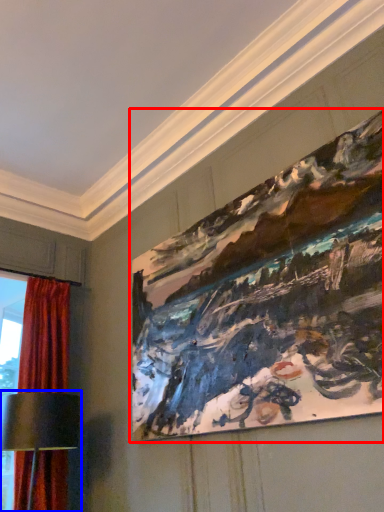
Question: Among these objects, which one is nearest to the camera, picture frame (highlighted by a red box) or table lamp (highlighted by a blue box)?

Choices:
 (A) picture frame
 (B) table lamp

Answer: (A)